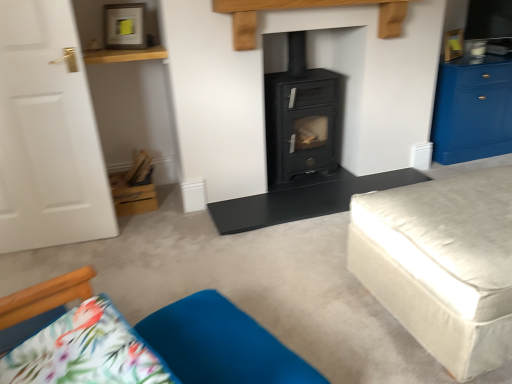
Identify the location of white matte door at left. (48, 133).

Identify the location of velvety blue cushion at lower center. The height and width of the screenshot is (384, 512). (221, 344).

You are a GUI agent. You are given a task and a screenshot of the screen. Output one action in this format:
    pyautogui.click(x=<x>, y=<y>)
    Task: Click on the blue glossy cabinet at right
    This screenshot has width=512, height=384.
    Given the screenshot: What is the action you would take?
    pyautogui.click(x=473, y=109)

Which point is more forward, (277, 97) or (260, 363)?

The point (260, 363) is in front.

Is black matte wood burning stove at center inside or outside of velvety blue cushion at lower center?

black matte wood burning stove at center lies outside velvety blue cushion at lower center.

Is black matte wood burning stove at center placed right next to velvety blue cushion at lower center?

There is a gap between black matte wood burning stove at center and velvety blue cushion at lower center.

Is blue glossy cabinet at right situated inside velvety blue cushion at lower center or outside?

blue glossy cabinet at right is not inside velvety blue cushion at lower center, it's outside.

From the image's perspective, is blue glossy cabinet at right positioned above or below velvety blue cushion at lower center?

blue glossy cabinet at right is situated higher than velvety blue cushion at lower center in the image.

Which is behind, blue glossy cabinet at right or velvety blue cushion at lower center?

blue glossy cabinet at right is more distant.

How different are the orientations of blue glossy cabinet at right and velvety blue cushion at lower center in degrees?

The facing directions of blue glossy cabinet at right and velvety blue cushion at lower center are 111 degrees apart.

Considering the sizes of beige fabric ottoman at right and black matte table at center in the image, is beige fabric ottoman at right taller or shorter than black matte table at center?

Clearly, beige fabric ottoman at right is taller compared to black matte table at center.

Looking at this image, from the image's perspective, would you say beige fabric ottoman at right is positioned over black matte table at center?

No, from the image's perspective, beige fabric ottoman at right is not above black matte table at center.

Is beige fabric ottoman at right not within black matte table at center?

Yes.

Is beige fabric ottoman at right aimed at black matte table at center?

Yes, beige fabric ottoman at right faces towards black matte table at center.

Based on the photo, is blue glossy cabinet at right next to beige fabric ottoman at right?

No, blue glossy cabinet at right is not making contact with beige fabric ottoman at right.

Identify the location of studio couch in front of the blue glossy cabinet at right. The height and width of the screenshot is (384, 512). (442, 264).

Looking at their sizes, would you say blue glossy cabinet at right is wider or thinner than beige fabric ottoman at right?

In the image, blue glossy cabinet at right appears to be more narrow than beige fabric ottoman at right.

What's the angular difference between blue glossy cabinet at right and beige fabric ottoman at right's facing directions?

There is a 177-degree angle between the facing directions of blue glossy cabinet at right and beige fabric ottoman at right.

Is black matte wood burning stove at center taller than beige fabric ottoman at right?

Yes.

Which of these two, black matte wood burning stove at center or beige fabric ottoman at right, is bigger?

beige fabric ottoman at right is bigger.

Is black matte wood burning stove at center looking in the opposite direction of beige fabric ottoman at right?

No, black matte wood burning stove at center is not facing away from beige fabric ottoman at right.

Is beige fabric ottoman at right taller than black matte wood burning stove at center?

Incorrect, the height of beige fabric ottoman at right is not larger of that of black matte wood burning stove at center.

At what (x,y) coordinates should I click in order to perform the action: click on wood burning stove that appears behind the beige fabric ottoman at right. Please return your answer as a coordinate pair (x, y). The height and width of the screenshot is (384, 512). Looking at the image, I should click on (301, 118).

From the image's perspective, is beige fabric ottoman at right above or below black matte wood burning stove at center?

beige fabric ottoman at right is situated lower than black matte wood burning stove at center in the image.

Based on the photo, is beige fabric ottoman at right at the right side of black matte wood burning stove at center?

Correct, you'll find beige fabric ottoman at right to the right of black matte wood burning stove at center.

At what (x,y) coordinates should I click in order to perform the action: click on studio couch on the right of white matte door at left. Please return your answer as a coordinate pair (x, y). The image size is (512, 384). Looking at the image, I should click on (442, 264).

Is beige fabric ottoman at right to the left or to the right of white matte door at left in the image?

Based on their positions, beige fabric ottoman at right is located to the right of white matte door at left.

Where is `wood burning stove on the right of the velvety blue cushion at lower center`? The width and height of the screenshot is (512, 384). wood burning stove on the right of the velvety blue cushion at lower center is located at coordinates (301, 118).

The image size is (512, 384). I want to click on pillow located in front of the blue glossy cabinet at right, so click(221, 344).

Estimate the real-world distances between objects in this image. Which object is further from blue glossy cabinet at right, beige fabric ottoman at right or white matte door at left?

The object further to blue glossy cabinet at right is white matte door at left.

Which object lies further to the anchor point blue glossy cabinet at right, white matte door at left or black matte table at center?

Based on the image, white matte door at left appears to be further to blue glossy cabinet at right.

Looking at the image, which one is located closer to velvety blue cushion at lower center, beige fabric ottoman at right or white matte door at left?

The object closer to velvety blue cushion at lower center is beige fabric ottoman at right.

Which object lies nearer to the anchor point white matte door at left, black matte wood burning stove at center or velvety blue cushion at lower center?

velvety blue cushion at lower center is closer to white matte door at left.

Estimate the real-world distances between objects in this image. Which object is closer to beige fabric ottoman at right, black matte wood burning stove at center or blue glossy cabinet at right?

black matte wood burning stove at center.

From the image, which object appears to be nearer to black matte table at center, black matte wood burning stove at center or white matte door at left?

Among the two, black matte wood burning stove at center is located nearer to black matte table at center.

Looking at the image, which one is located further to velvety blue cushion at lower center, blue glossy cabinet at right or black matte wood burning stove at center?

The object further to velvety blue cushion at lower center is blue glossy cabinet at right.

From the image, which object appears to be nearer to velvety blue cushion at lower center, black matte table at center or white matte door at left?

black matte table at center is closer to velvety blue cushion at lower center.

You are a GUI agent. You are given a task and a screenshot of the screen. Output one action in this format:
    pyautogui.click(x=<x>, y=<y>)
    Task: Click on the wood burning stove located between white matte door at left and beige fabric ottoman at right in the left-right direction
    Image resolution: width=512 pixels, height=384 pixels.
    Given the screenshot: What is the action you would take?
    pyautogui.click(x=301, y=118)

Where is `pillow situated between white matte door at left and black matte wood burning stove at center from left to right`? The image size is (512, 384). pillow situated between white matte door at left and black matte wood burning stove at center from left to right is located at coordinates (221, 344).

Find the location of a particular element. The height and width of the screenshot is (384, 512). table located between white matte door at left and blue glossy cabinet at right in the left-right direction is located at coordinates (303, 199).

I want to click on studio couch between velvety blue cushion at lower center and black matte table at center along the z-axis, so (442, 264).